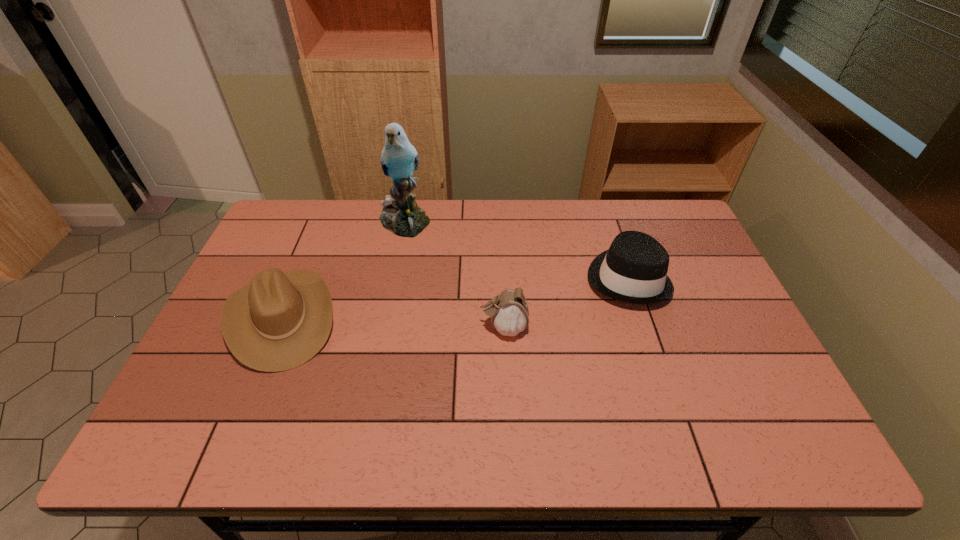
Identify which object is the third closest to the leftmost object. Please provide its 2D coordinates. Your answer should be formatted as a tuple, i.e. [(x, y)], where the tuple contains the x and y coordinates of a point satisfying the conditions above.

[(634, 269)]

Where is `free point that satisfies the following two spatial constraints: 1. on the face of the rightmost object; 2. on the left side of the farthest object`? Image resolution: width=960 pixels, height=540 pixels. free point that satisfies the following two spatial constraints: 1. on the face of the rightmost object; 2. on the left side of the farthest object is located at coordinates (394, 278).

What are the coordinates of `vacant region that satisfies the following two spatial constraints: 1. on the face of the tallest object; 2. on the left side of the fedora` in the screenshot? It's located at (394, 278).